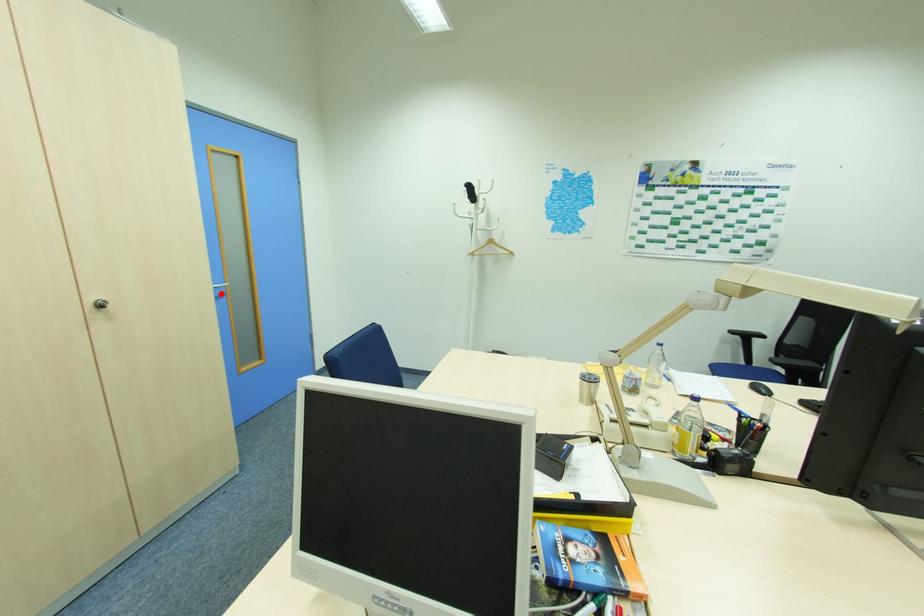
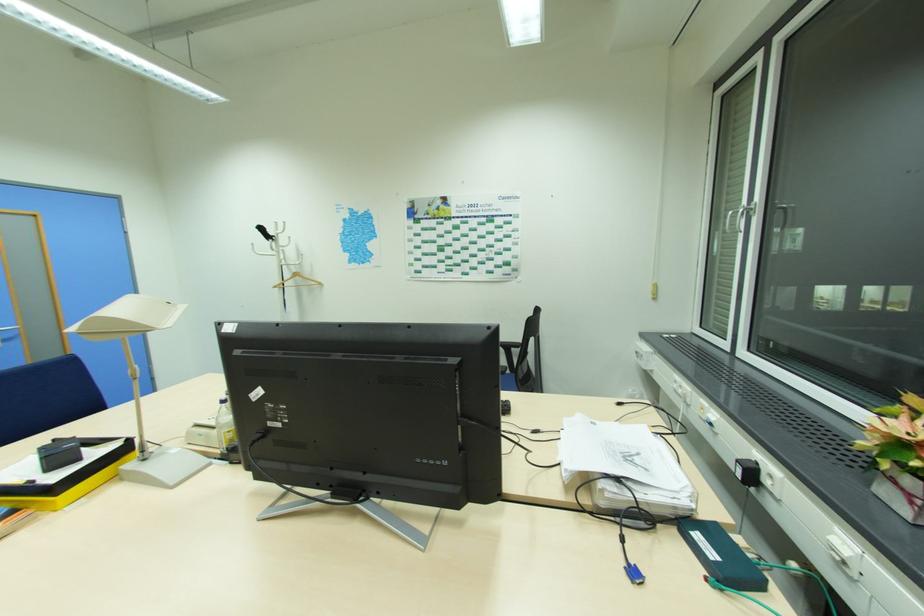
Question: I am providing you with two images of the same scene from different viewpoints. Image1 has a red point marked. In image2, the corresponding 3D location appears at what relative position? Reply with the corresponding letter.

Choices:
 (A) Closer
 (B) Farther

Answer: (B)